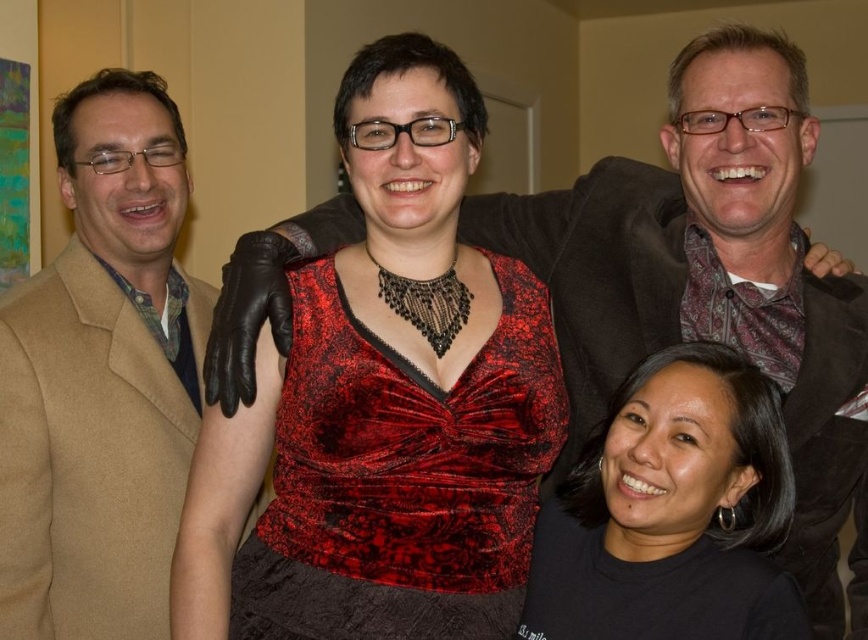
In the scene shown: Can you confirm if matte black jacket at upper right is positioned to the right of tan woolen jacket at left?

Yes, matte black jacket at upper right is to the right of tan woolen jacket at left.

Does matte black jacket at upper right lie in front of tan woolen jacket at left?

Yes, it is.

Is point (248, 342) farther from viewer compared to point (44, 348)?

No, (248, 342) is in front of (44, 348).

Locate an element on the screen. Image resolution: width=868 pixels, height=640 pixels. matte black jacket at upper right is located at coordinates tap(709, 308).

Does matte black jacket at upper right have a smaller size compared to black matte shirt at lower right?

No.

Consider the image. Is matte black jacket at upper right positioned at the back of black matte shirt at lower right?

Yes.

Does point (655, 227) come behind point (559, 636)?

Yes, point (655, 227) is farther from viewer.

Find the location of a particular element. matte black jacket at upper right is located at coordinates (709, 308).

Between tan woolen jacket at left and black matte shirt at lower right, which one is positioned lower?

black matte shirt at lower right

Can you confirm if tan woolen jacket at left is positioned to the left of black matte shirt at lower right?

Yes, tan woolen jacket at left is to the left of black matte shirt at lower right.

Is point (30, 605) farther from camera compared to point (646, 554)?

That is True.

Where is `tan woolen jacket at left`? tan woolen jacket at left is located at coordinates (102, 378).